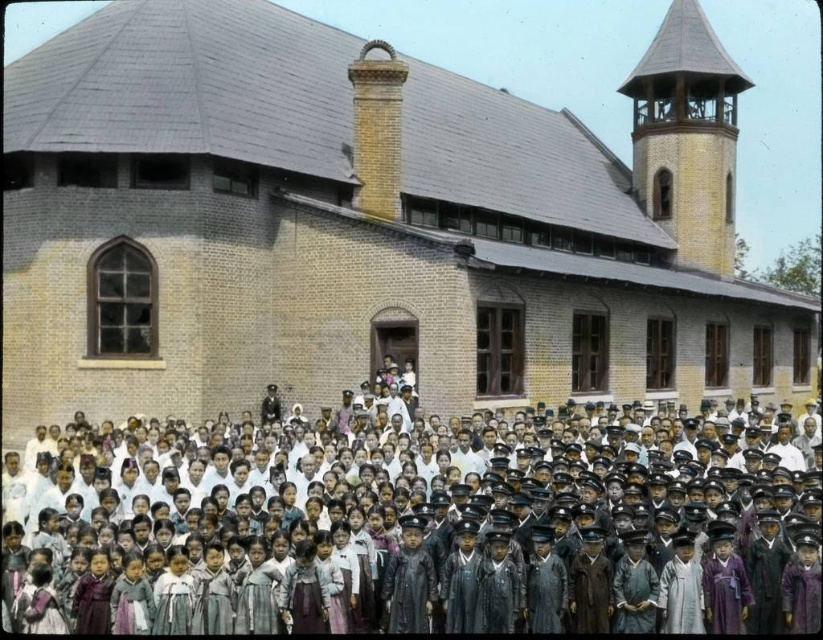
Between yellow brick church at center and wooden spire at upper right, which one has less height?

Standing shorter between the two is wooden spire at upper right.

Is yellow brick church at center smaller than wooden spire at upper right?

Actually, yellow brick church at center might be larger than wooden spire at upper right.

Which is in front, point (244, 353) or point (658, 81)?

Point (244, 353) is more forward.

Where is `yellow brick church at center`? yellow brick church at center is located at coordinates (365, 225).

Who is more distant from viewer, (640, 340) or (412, 486)?

The point (640, 340) is more distant.

In the scene shown: Is yellow brick church at center below dark brown uniform at center?

Actually, yellow brick church at center is above dark brown uniform at center.

Is point (601, 204) positioned after point (503, 534)?

Yes, it is behind point (503, 534).

Identify the location of yellow brick church at center. The image size is (823, 640). (365, 225).

The width and height of the screenshot is (823, 640). Find the location of `dark brown uniform at center`. dark brown uniform at center is located at coordinates (407, 532).

Identify the location of dark brown uniform at center. (407, 532).